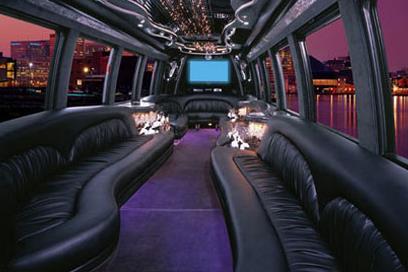
The width and height of the screenshot is (408, 272). Find the location of `carpet`. carpet is located at coordinates (200, 184).